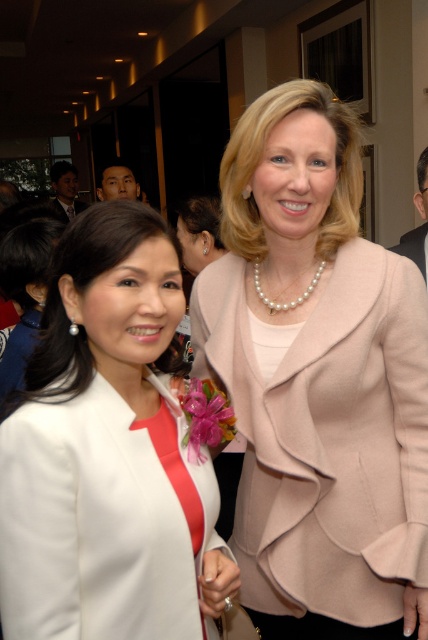
Who is more forward, (267, 150) or (142, 193)?

Positioned in front is point (267, 150).

Is pearl necklace at upper center taller than matte black face at upper left?

Indeed, pearl necklace at upper center has a greater height compared to matte black face at upper left.

At what (x,y) coordinates should I click in order to perform the action: click on pearl necklace at upper center. Please return your answer as a coordinate pair (x, y). The width and height of the screenshot is (428, 640). Looking at the image, I should click on [318, 380].

In order to click on pearl necklace at upper center in this screenshot , I will do `click(318, 380)`.

Is white satin blazer at center to the left of matte black suit at left from the viewer's perspective?

Incorrect, white satin blazer at center is not on the left side of matte black suit at left.

Does white satin blazer at center appear on the right side of matte black suit at left?

Correct, you'll find white satin blazer at center to the right of matte black suit at left.

Is point (136, 211) less distant than point (59, 164)?

Yes.

You are a GUI agent. You are given a task and a screenshot of the screen. Output one action in this format:
    pyautogui.click(x=<x>, y=<y>)
    Task: Click on the white satin blazer at center
    
    Given the screenshot: What is the action you would take?
    pyautogui.click(x=107, y=452)

Which of these two, matte black face at upper left or matte black suit at left, stands taller?

With more height is matte black suit at left.

Can you confirm if matte black face at upper left is shorter than matte black suit at left?

Yes.

You are a GUI agent. You are given a task and a screenshot of the screen. Output one action in this format:
    pyautogui.click(x=<x>, y=<y>)
    Task: Click on the matte black face at upper left
    The width and height of the screenshot is (428, 640).
    Given the screenshot: What is the action you would take?
    pyautogui.click(x=118, y=182)

The height and width of the screenshot is (640, 428). I want to click on matte black face at upper left, so click(118, 182).